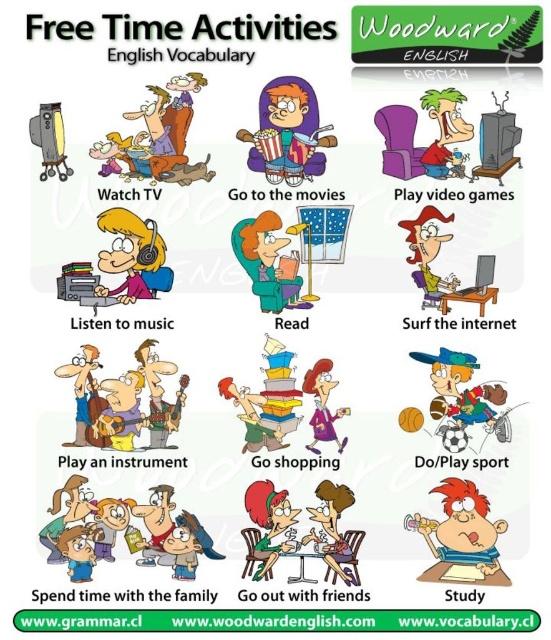
Question: Estimate the real-world distances between objects in this image. Which object is farther from the matte purple shirt at center?

Choices:
 (A) matte yellow book at center
 (B) reddish hairbrush at center
 (C) matte yellow shirt at center
 (D) matte orange shirt at center

Answer: (D)

Question: From the image, what is the correct spatial relationship of matte orange shirt at center in relation to matte purple shirt at center?

Choices:
 (A) right
 (B) left

Answer: (B)

Question: Considering the real-world distances, which object is farthest from the matte yellow book at center?

Choices:
 (A) matte purple shirt at center
 (B) matte orange shirt at center
 (C) matte yellow shirt at center

Answer: (C)

Question: Does matte yellow book at center have a larger size compared to matte yellow shirt at center?

Choices:
 (A) yes
 (B) no

Answer: (A)

Question: Does matte orange shirt at center have a greater width compared to matte yellow shirt at center?

Choices:
 (A) yes
 (B) no

Answer: (A)

Question: Based on their relative distances, which object is nearer to the matte yellow book at center?

Choices:
 (A) matte yellow shirt at center
 (B) matte purple shirt at center
 (C) matte orange shirt at center
 (D) reddish hairbrush at center

Answer: (C)